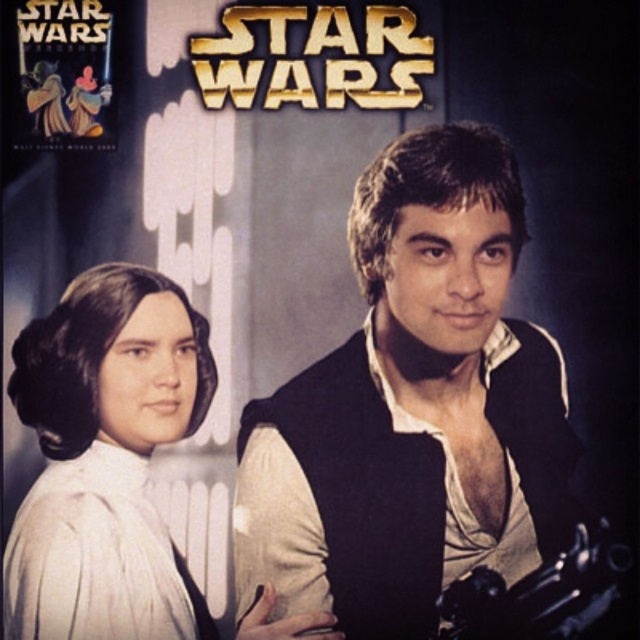
Question: Can you confirm if white satin dress at left is bigger than polished metal gun at lower right?

Choices:
 (A) yes
 (B) no

Answer: (A)

Question: Where is matte black vest at center located in relation to white satin dress at left in the image?

Choices:
 (A) right
 (B) left

Answer: (A)

Question: Which is farther from the matte black vest at center?

Choices:
 (A) white satin dress at left
 (B) polished metal gun at lower right

Answer: (A)

Question: Is matte black vest at center to the right of polished metal gun at lower right from the viewer's perspective?

Choices:
 (A) no
 (B) yes

Answer: (A)

Question: Which point appears closest to the camera in this image?

Choices:
 (A) click(x=83, y=621)
 (B) click(x=248, y=445)

Answer: (A)

Question: Among these points, which one is farthest from the camera?

Choices:
 (A) (451, 182)
 (B) (529, 620)

Answer: (B)